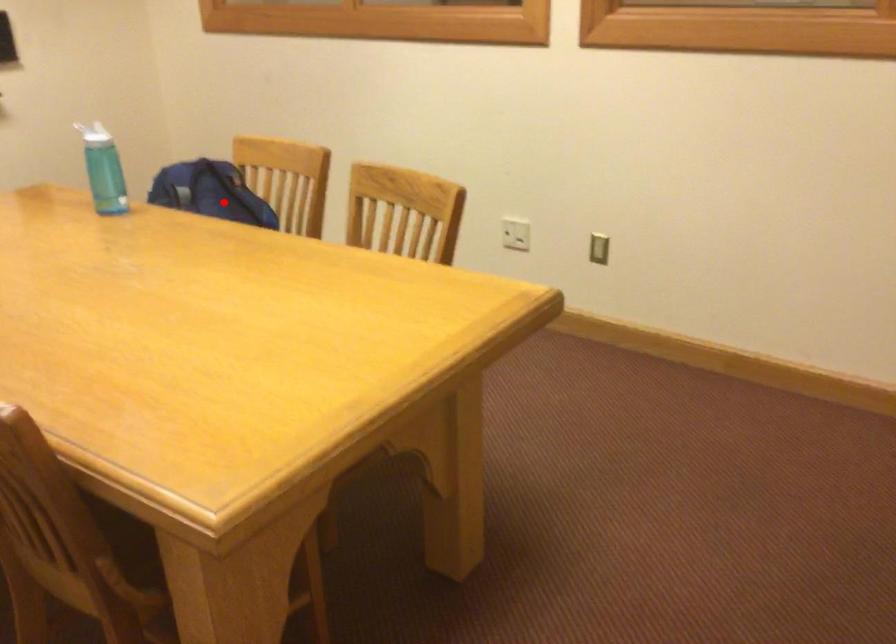
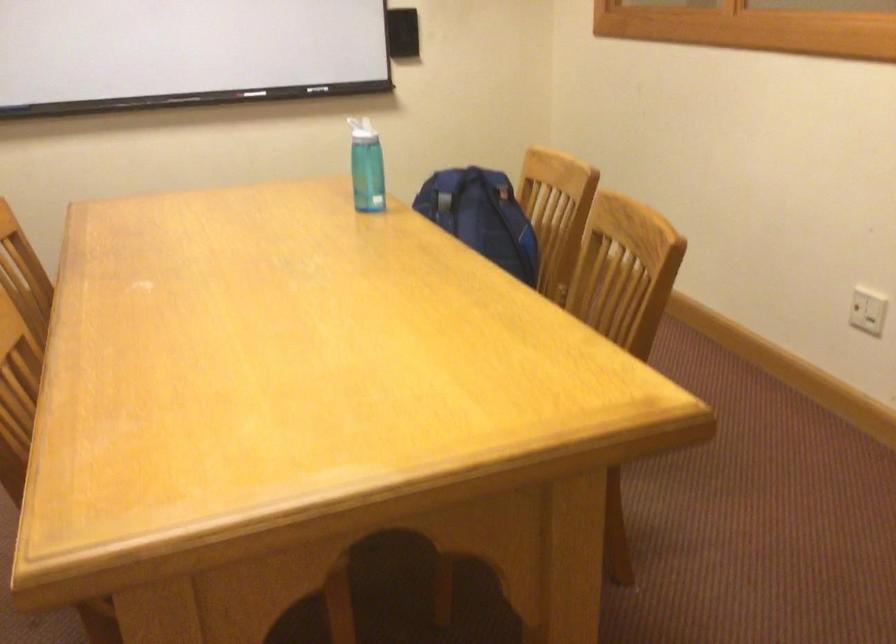
Find the pixel in the second image that matches the highlighted location in the first image.

(481, 216)